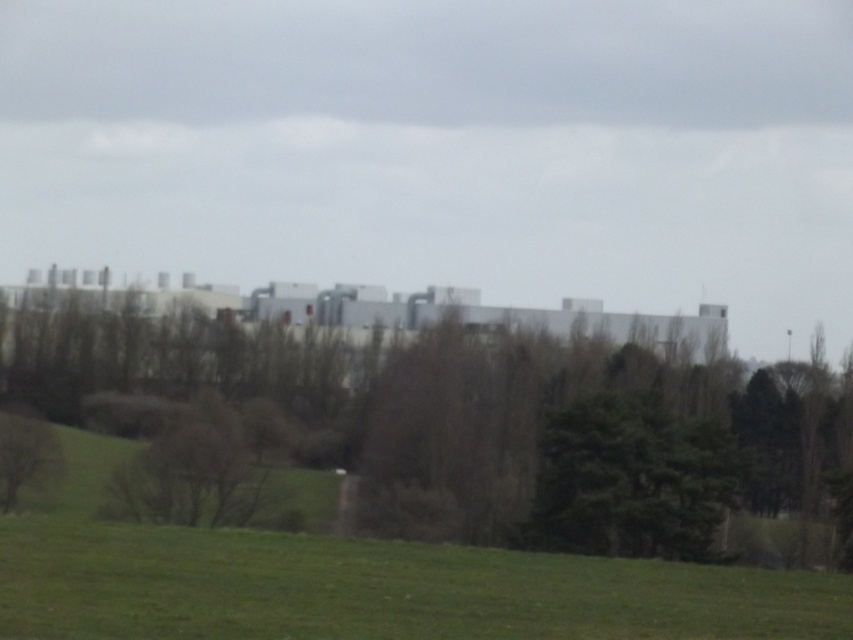
You are an environmental inspector assessing the site. You need to determine if the green leafy tree at lower left and the green leafy tree at center are both visible from the front entrance located at the bottom of the slope. Based on their positions, can you confirm if both trees are visible?

The green leafy tree at lower left is behind the green leafy tree at center, so only the green leafy tree at center is visible from the front entrance. The green leafy tree at lower left is obscured by the green leafy tree at center.

From the picture: You are standing at the base of the green leafy tree at center. Looking towards the industrial building in the background, which direction should you walk to reach it?

Since the industrial building is in the background and you are at the base of the green leafy tree at center, you should walk towards the direction of the industrial building, which is likely behind the tree relative to your position.

You are standing at the point with coordinates point (45, 433) and want to walk towards the industrial building in the background. Is the point point (416, 518) blocking your path?

Point (416, 518) is in front of point (45, 433), so yes, the point point (416, 518) is blocking your path.